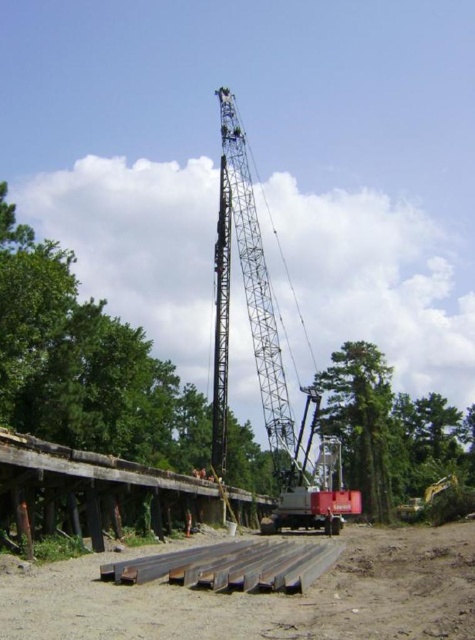
You are a construction worker standing at the base of the crane. You need to check two points marked on the ground for safety. The first point is at coordinates point (269, 292) and the second is at point (177, 582). Which point is closer to you?

Point (269, 292) is closer to you because it is further to the viewer than point (177, 582), meaning it is nearer in the scene.

You are a construction worker who needs to determine if the metallic gray crane at center can be safely lowered onto the metal at lower center. Based on their heights, is this possible?

The metallic gray crane at center is much taller than the metal at lower center, so lowering it directly might not be safe due to the height difference. Adjustments or additional equipment may be necessary to ensure a secure placement.